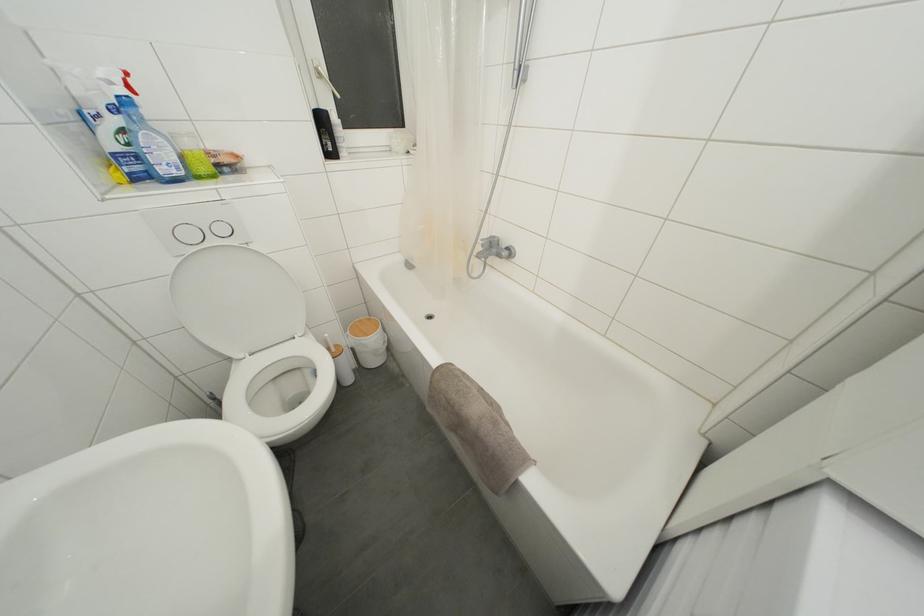
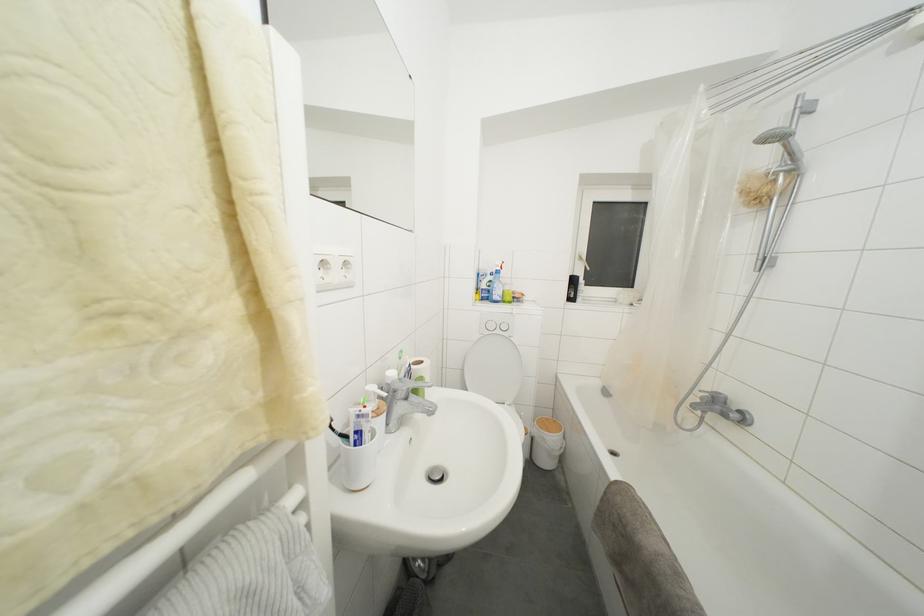
Find the pixel in the second image that matches point (249, 254) in the first image.

(513, 344)